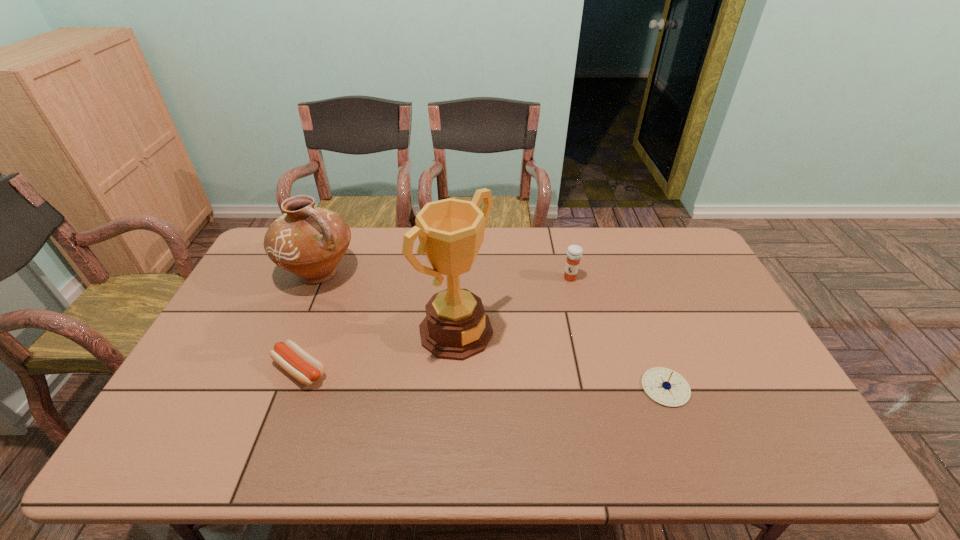
Image resolution: width=960 pixels, height=540 pixels. What are the coordinates of `vacant space on the desktop that is between the sausage and the rightmost object and is positioned on the side of the second tallest object with the handle` in the screenshot? It's located at (446, 376).

Image resolution: width=960 pixels, height=540 pixels. Find the location of `free space on the desktop that is between the shortest object and the rightmost object and is positioned on the front-facing side of the award`. free space on the desktop that is between the shortest object and the rightmost object and is positioned on the front-facing side of the award is located at coordinates (526, 381).

Where is `free space on the desktop that is between the sausage and the rightmost object and is positioned on the label side of the third tallest object`? Image resolution: width=960 pixels, height=540 pixels. free space on the desktop that is between the sausage and the rightmost object and is positioned on the label side of the third tallest object is located at coordinates (492, 379).